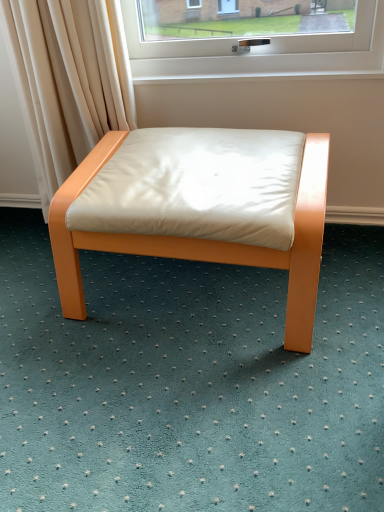
Locate an element on the screen. The width and height of the screenshot is (384, 512). vacant area that is in front of white leather stool at center is located at coordinates (201, 408).